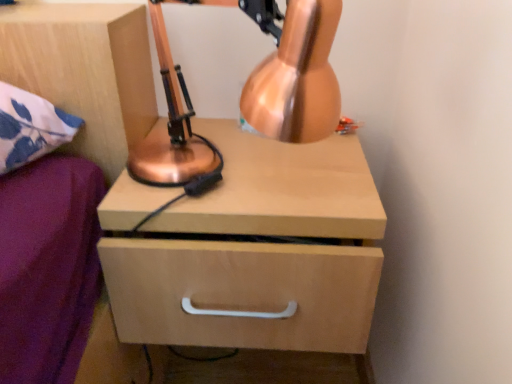
Question: Should I look upward or downward to see light wood drawer at center?

Choices:
 (A) up
 (B) down

Answer: (B)